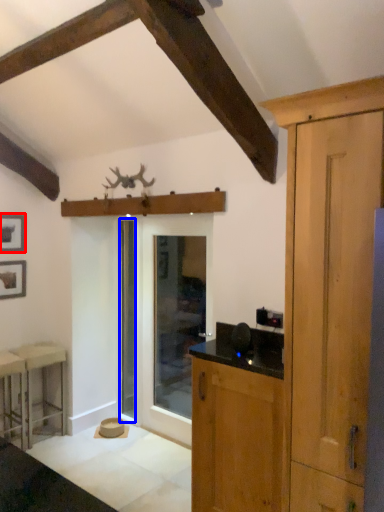
Question: Which object appears farthest to the camera in this image, picture frame (highlighted by a red box) or screen door (highlighted by a blue box)?

Choices:
 (A) picture frame
 (B) screen door

Answer: (B)